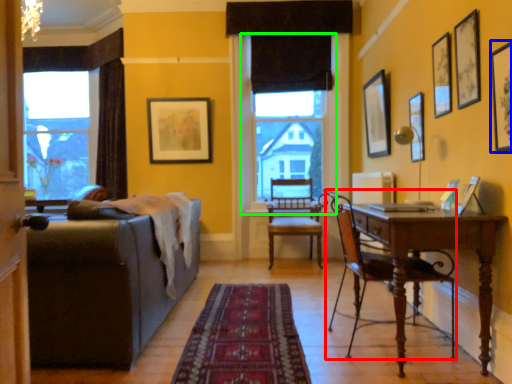
Question: Which object is the closest to the chair (highlighted by a red box)? Choose among these: picture frame (highlighted by a blue box) or window screen (highlighted by a green box).

Choices:
 (A) picture frame
 (B) window screen

Answer: (A)